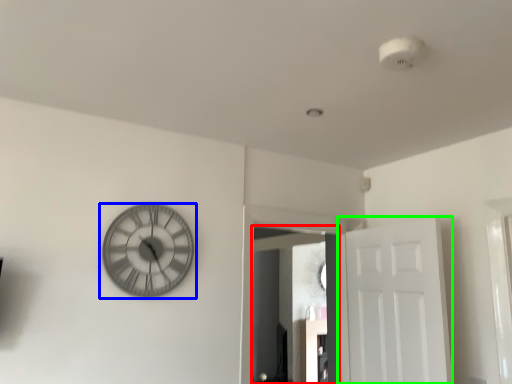
Question: Which is farther away from mirror (highlighted by a red box)? wall clock (highlighted by a blue box) or door (highlighted by a green box)?

Choices:
 (A) wall clock
 (B) door

Answer: (A)